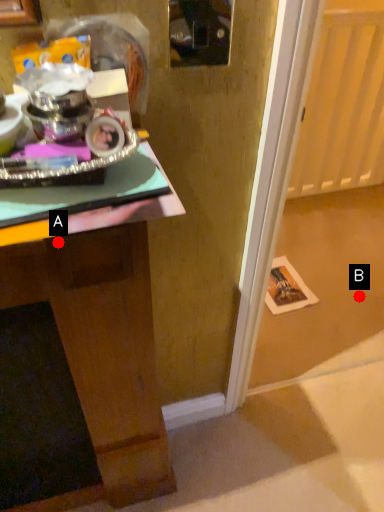
Question: Two points are circled on the image, labeled by A and B beside each circle. Among these points, which one is farthest from the camera?

Choices:
 (A) A is further
 (B) B is further

Answer: (B)